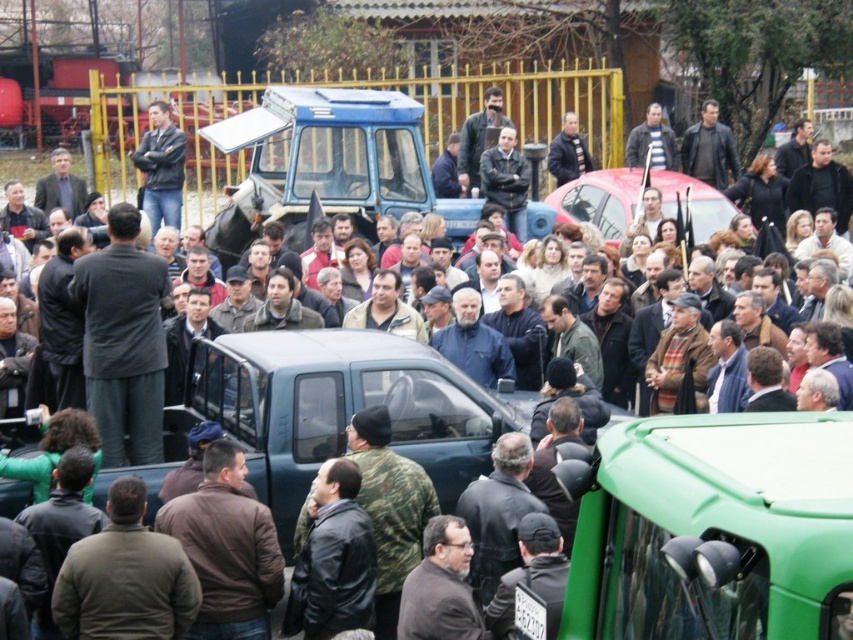
Question: Which of the following is the farthest from the observer?

Choices:
 (A) (190, 627)
 (B) (132, 154)
 (C) (698, 234)
 (D) (466, 147)

Answer: (D)

Question: Can you confirm if matte black truck at center is positioned to the left of dark gray jacket at upper center?

Choices:
 (A) no
 (B) yes

Answer: (B)

Question: Which point appears farthest from the camera in this image?

Choices:
 (A) (525, 186)
 (B) (666, 129)
 (C) (490, 125)
 (D) (660, 172)

Answer: (B)

Question: Which object appears closest to the camera in this image?

Choices:
 (A) dark brown leather jacket at center
 (B) leather jacket at center
 (C) matte black truck at center

Answer: (B)

Question: Is matte black truck at center above leather jacket at upper right?

Choices:
 (A) no
 (B) yes

Answer: (A)

Question: Is metallic red car at center above leather jacket at upper right?

Choices:
 (A) no
 (B) yes

Answer: (A)